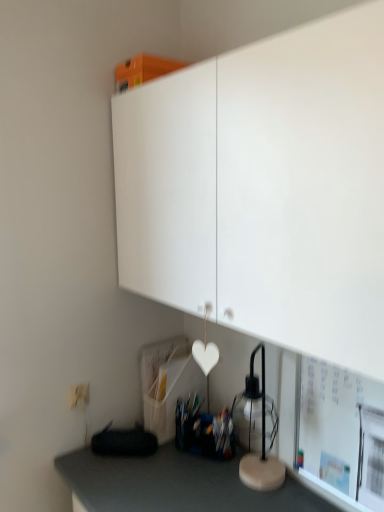
Question: Is white matte cabinet at upper center positioned with its back to transparent glass table lamp at lower right?

Choices:
 (A) no
 (B) yes

Answer: (A)

Question: Does white matte cabinet at upper center come behind transparent glass table lamp at lower right?

Choices:
 (A) yes
 (B) no

Answer: (B)

Question: From the image's perspective, does white matte cabinet at upper center appear higher than transparent glass table lamp at lower right?

Choices:
 (A) no
 (B) yes

Answer: (B)

Question: Can you confirm if white matte cabinet at upper center is shorter than transparent glass table lamp at lower right?

Choices:
 (A) no
 (B) yes

Answer: (A)

Question: Is white matte cabinet at upper center at the right side of transparent glass table lamp at lower right?

Choices:
 (A) yes
 (B) no

Answer: (B)

Question: Is white matte electric outlet at lower left inside or outside of white matte cabinet at upper center?

Choices:
 (A) outside
 (B) inside

Answer: (A)

Question: Visually, is white matte electric outlet at lower left positioned to the left or to the right of white matte cabinet at upper center?

Choices:
 (A) left
 (B) right

Answer: (A)

Question: Looking at their shapes, would you say white matte electric outlet at lower left is wider or thinner than white matte cabinet at upper center?

Choices:
 (A) wide
 (B) thin

Answer: (B)

Question: Relative to white matte cabinet at upper center, is white matte electric outlet at lower left in front or behind?

Choices:
 (A) behind
 (B) front

Answer: (A)

Question: Looking at their shapes, would you say white matte cabinet at upper center is wider or thinner than white matte electric outlet at lower left?

Choices:
 (A) wide
 (B) thin

Answer: (A)

Question: From a real-world perspective, is white matte cabinet at upper center above or below white matte electric outlet at lower left?

Choices:
 (A) above
 (B) below

Answer: (A)

Question: Would you say white matte cabinet at upper center is to the left or to the right of white matte electric outlet at lower left in the picture?

Choices:
 (A) left
 (B) right

Answer: (B)

Question: Considering the positions of white matte cabinet at upper center and white matte electric outlet at lower left in the image, is white matte cabinet at upper center bigger or smaller than white matte electric outlet at lower left?

Choices:
 (A) big
 (B) small

Answer: (A)

Question: Would you say white matte electric outlet at lower left is to the left or to the right of transparent glass table lamp at lower right in the picture?

Choices:
 (A) left
 (B) right

Answer: (A)

Question: Considering the positions of white matte electric outlet at lower left and transparent glass table lamp at lower right in the image, is white matte electric outlet at lower left taller or shorter than transparent glass table lamp at lower right?

Choices:
 (A) short
 (B) tall

Answer: (A)